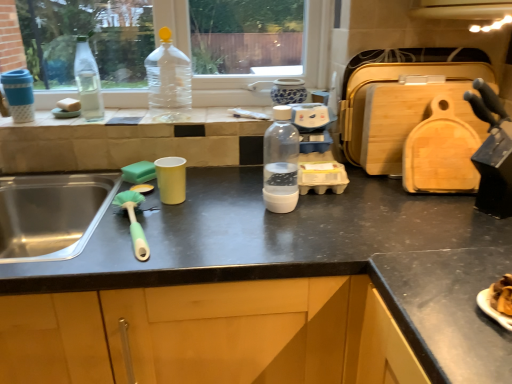
Image resolution: width=512 pixels, height=384 pixels. I want to click on free area in between clear glass bottle at left, which is the third bottle in front-to-back order, and transparent plastic bottle at upper center, arranged as the second bottle when viewed from the front, so click(121, 118).